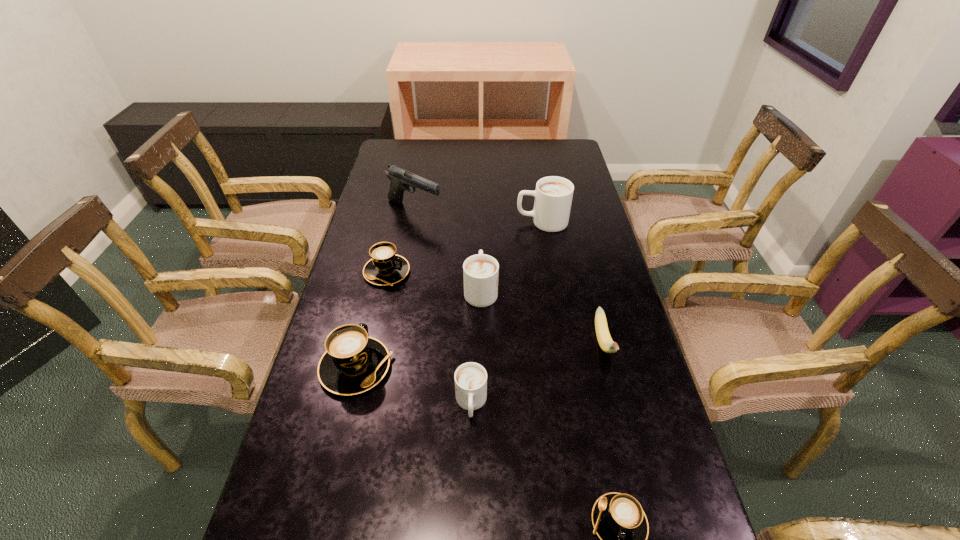
The width and height of the screenshot is (960, 540). What are the coordinates of `gun` in the screenshot? It's located at (401, 179).

You are a GUI agent. You are given a task and a screenshot of the screen. Output one action in this format:
    pyautogui.click(x=<x>, y=<y>)
    Task: Click on the biggest white cappuccino
    
    Given the screenshot: What is the action you would take?
    pyautogui.click(x=553, y=195)

The image size is (960, 540). What are the coordinates of `the rightmost white cappuccino` in the screenshot? It's located at (553, 195).

This screenshot has width=960, height=540. Identify the location of the second farthest white cappuccino. pyautogui.click(x=480, y=272).

The image size is (960, 540). I want to click on the biggest black cappuccino, so click(x=353, y=363).

The height and width of the screenshot is (540, 960). Find the location of `banana`. banana is located at coordinates (605, 341).

Where is `the nearest white cappuccino`? the nearest white cappuccino is located at coordinates (470, 378).

Identify the location of the second biggest black cappuccino. This screenshot has width=960, height=540. (x=385, y=268).

Identify the location of vacant space located at the muzzle of the black gun. The width and height of the screenshot is (960, 540). (471, 211).

Locate an element on the screen. This screenshot has width=960, height=540. blank space located 0.140m on the side with the handle of the tallest cappuccino is located at coordinates (475, 221).